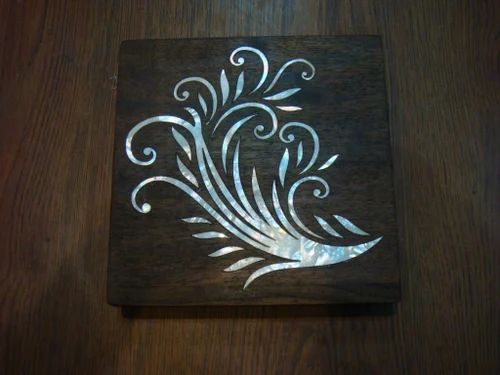
I want to click on top left corner of plank, so click(x=123, y=40).